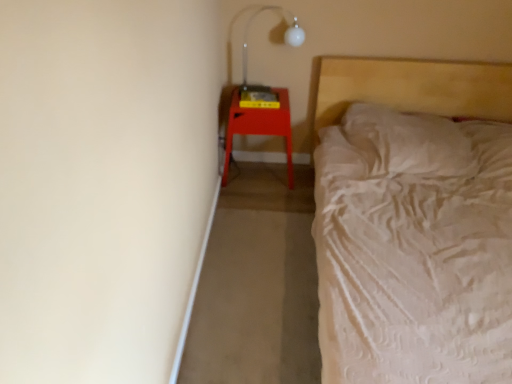
Question: From a real-world perspective, is matte red stool at right located beneath white textured bed at right?

Choices:
 (A) yes
 (B) no

Answer: (A)

Question: Is matte red stool at right further to the viewer compared to white textured bed at right?

Choices:
 (A) yes
 (B) no

Answer: (A)

Question: Does matte red stool at right turn towards white textured bed at right?

Choices:
 (A) yes
 (B) no

Answer: (B)

Question: Is matte red stool at right looking in the opposite direction of white textured bed at right?

Choices:
 (A) no
 (B) yes

Answer: (A)

Question: Is matte red stool at right touching white textured bed at right?

Choices:
 (A) yes
 (B) no

Answer: (B)

Question: Considering the relative sizes of matte red stool at right and white textured bed at right in the image provided, is matte red stool at right smaller than white textured bed at right?

Choices:
 (A) yes
 (B) no

Answer: (A)

Question: Considering the relative positions of matte red stool at right and transparent plastic lamp at upper right in the image provided, is matte red stool at right to the right of transparent plastic lamp at upper right from the viewer's perspective?

Choices:
 (A) yes
 (B) no

Answer: (B)

Question: Is matte red stool at right to the left of transparent plastic lamp at upper right from the viewer's perspective?

Choices:
 (A) no
 (B) yes

Answer: (B)

Question: Is matte red stool at right thinner than transparent plastic lamp at upper right?

Choices:
 (A) no
 (B) yes

Answer: (A)

Question: From the image's perspective, does matte red stool at right appear higher than transparent plastic lamp at upper right?

Choices:
 (A) no
 (B) yes

Answer: (A)

Question: From the image's perspective, is matte red stool at right beneath transparent plastic lamp at upper right?

Choices:
 (A) yes
 (B) no

Answer: (A)

Question: Is the depth of matte red stool at right greater than that of transparent plastic lamp at upper right?

Choices:
 (A) no
 (B) yes

Answer: (B)

Question: Considering the relative sizes of transparent plastic lamp at upper right and matte red stool at right in the image provided, is transparent plastic lamp at upper right taller than matte red stool at right?

Choices:
 (A) no
 (B) yes

Answer: (A)